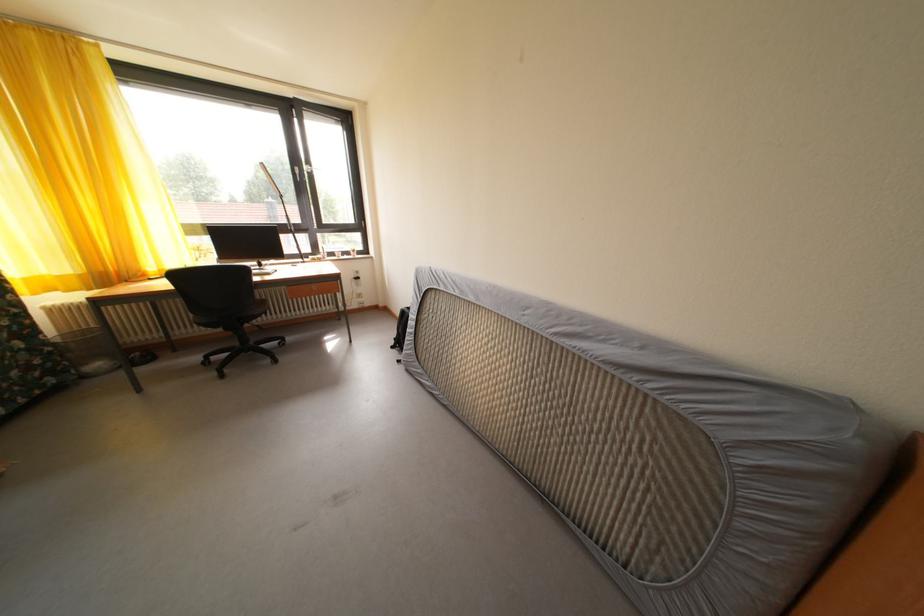
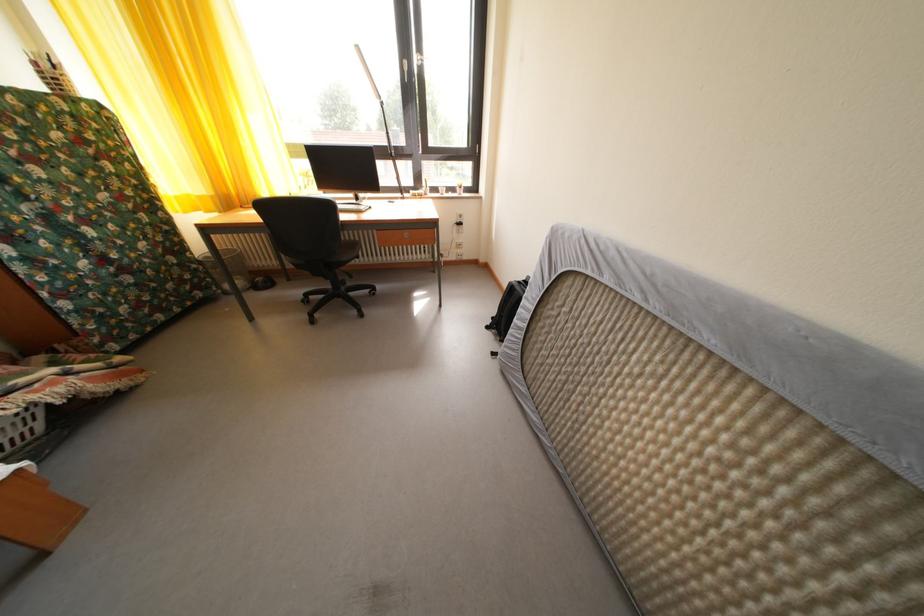
Question: The camera is either moving clockwise (left) or counter-clockwise (right) around the object. The first image is from the beginning of the video and the second image is from the end. Is the camera moving left or right when shooting the video?

Choices:
 (A) Left
 (B) Right

Answer: (B)